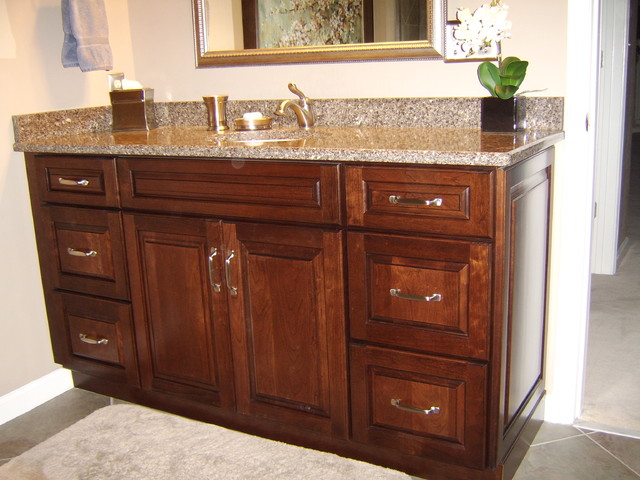
The width and height of the screenshot is (640, 480). I want to click on wood finished storage, so click(280, 302).